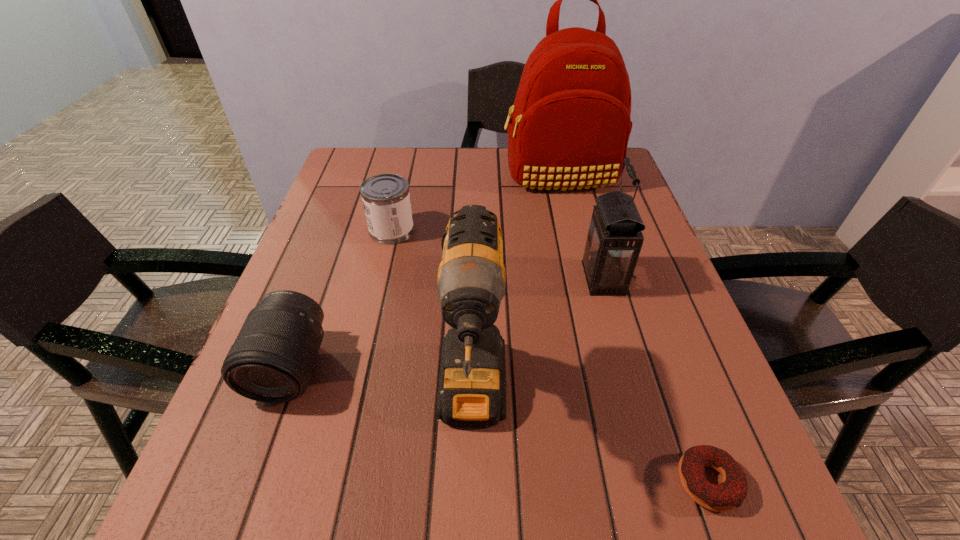
Locate an element on the screen. The height and width of the screenshot is (540, 960). vacant space that satisfies the following two spatial constraints: 1. with the drill bit of the drill facing forward; 2. on the right side of the doughnut is located at coordinates (471, 482).

Locate an element on the screen. The image size is (960, 540). free spot that satisfies the following two spatial constraints: 1. on the surface of the doughnut; 2. on the right side of the telephoto lens is located at coordinates (249, 482).

Image resolution: width=960 pixels, height=540 pixels. I want to click on free region that satisfies the following two spatial constraints: 1. on the front-facing side of the shortest object; 2. on the left side of the backpack, so click(636, 482).